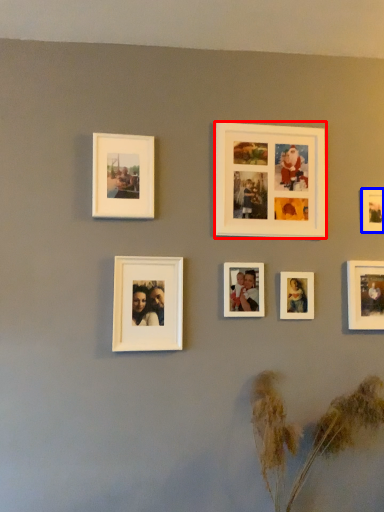
Question: Among these objects, which one is nearest to the camera, picture frame (highlighted by a red box) or picture frame (highlighted by a blue box)?

Choices:
 (A) picture frame
 (B) picture frame

Answer: (A)